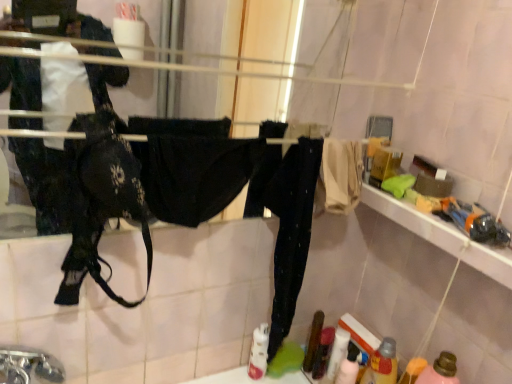
Question: From the image's perspective, is translucent plastic bottle at lower right, which ranks as the 2th bottle in right-to-left order, on pink matte bottle at lower right, which is counted as the 2th bottle, starting from the left?

Choices:
 (A) no
 (B) yes

Answer: (B)

Question: Would you consider translucent plastic bottle at lower right, which ranks as the 2th bottle in right-to-left order, to be distant from pink matte bottle at lower right, which is counted as the 2th bottle, starting from the left?

Choices:
 (A) yes
 (B) no

Answer: (B)

Question: Is translucent plastic bottle at lower right, which ranks as the 2th bottle in right-to-left order, at the right side of pink matte bottle at lower right, placed as the first bottle when sorted from right to left?

Choices:
 (A) yes
 (B) no

Answer: (B)

Question: Does translucent plastic bottle at lower right, which ranks as the 2th bottle in right-to-left order, turn towards pink matte bottle at lower right, which is counted as the 2th bottle, starting from the left?

Choices:
 (A) no
 (B) yes

Answer: (A)

Question: Can you confirm if translucent plastic bottle at lower right, which ranks as the 2th bottle in right-to-left order, is thinner than pink matte bottle at lower right, placed as the first bottle when sorted from right to left?

Choices:
 (A) no
 (B) yes

Answer: (B)

Question: Does point (26, 377) appear closer or farther from the camera than point (366, 374)?

Choices:
 (A) farther
 (B) closer

Answer: (B)

Question: Considering the positions of silver metallic faucet at lower left and translucent plastic bottle at lower right, which ranks as the 2th bottle in right-to-left order, in the image, is silver metallic faucet at lower left taller or shorter than translucent plastic bottle at lower right, which ranks as the 2th bottle in right-to-left order,?

Choices:
 (A) tall
 (B) short

Answer: (B)

Question: Considering the positions of silver metallic faucet at lower left and translucent plastic bottle at lower right, positioned as the 1th bottle in left-to-right order, in the image, is silver metallic faucet at lower left wider or thinner than translucent plastic bottle at lower right, positioned as the 1th bottle in left-to-right order,?

Choices:
 (A) thin
 (B) wide

Answer: (B)

Question: From a real-world perspective, relative to translucent plastic bottle at lower right, positioned as the 1th bottle in left-to-right order, is silver metallic faucet at lower left vertically above or below?

Choices:
 (A) above
 (B) below

Answer: (A)

Question: From a real-world perspective, is translucent plastic bottle at lower right, positioned as the 1th bottle in left-to-right order, above or below pink matte bottle at lower right, which is counted as the 2th bottle, starting from the left?

Choices:
 (A) below
 (B) above

Answer: (A)

Question: Based on their positions, is translucent plastic bottle at lower right, positioned as the 1th bottle in left-to-right order, located to the left or right of pink matte bottle at lower right, placed as the first bottle when sorted from right to left?

Choices:
 (A) left
 (B) right

Answer: (A)

Question: In terms of height, does translucent plastic bottle at lower right, positioned as the 1th bottle in left-to-right order, look taller or shorter compared to pink matte bottle at lower right, placed as the first bottle when sorted from right to left?

Choices:
 (A) short
 (B) tall

Answer: (A)

Question: Looking at their shapes, would you say translucent plastic bottle at lower right, which ranks as the 2th bottle in right-to-left order, is wider or thinner than pink matte bottle at lower right, placed as the first bottle when sorted from right to left?

Choices:
 (A) wide
 (B) thin

Answer: (B)

Question: From the image's perspective, relative to silver metallic faucet at lower left, is translucent plastic bottle at lower right, positioned as the 1th bottle in left-to-right order, above or below?

Choices:
 (A) above
 (B) below

Answer: (B)

Question: From a real-world perspective, is translucent plastic bottle at lower right, positioned as the 1th bottle in left-to-right order, positioned above or below silver metallic faucet at lower left?

Choices:
 (A) above
 (B) below

Answer: (B)